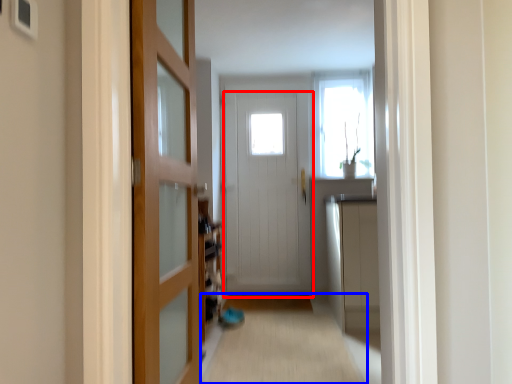
Question: Which object is closer to the camera taking this photo, door (highlighted by a red box) or alley (highlighted by a blue box)?

Choices:
 (A) door
 (B) alley

Answer: (B)